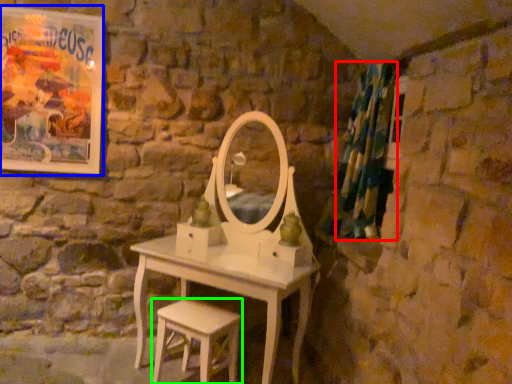
Question: Which object is positioned closest to shower curtain (highlighted by a red box)? Select from poster page (highlighted by a blue box) and stool (highlighted by a green box).

Choices:
 (A) poster page
 (B) stool

Answer: (B)